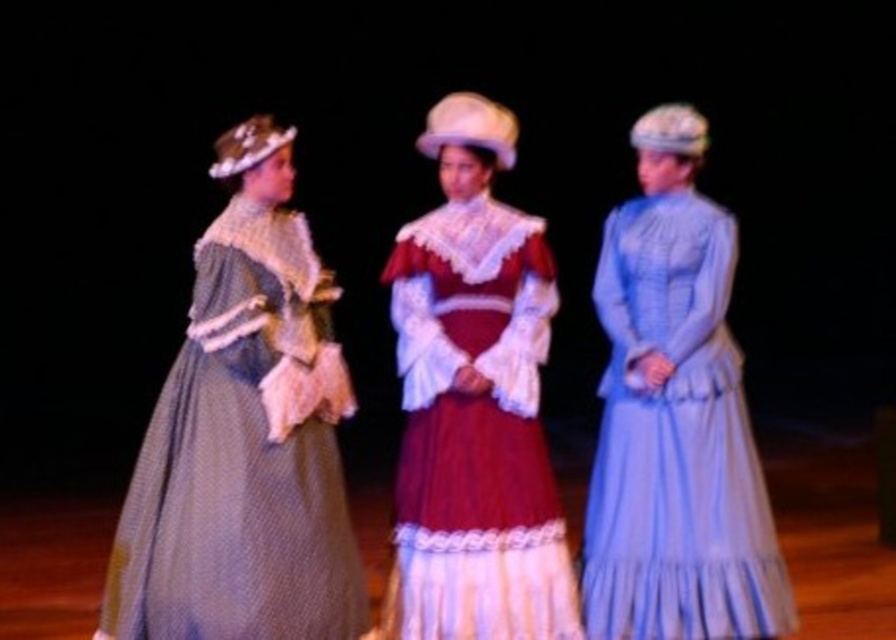
Question: Which point appears closest to the camera in this image?

Choices:
 (A) (480, 124)
 (B) (644, 625)
 (C) (338, 586)

Answer: (C)

Question: Does polka dot fabric dress at left have a greater width compared to velvet maroon dress at center?

Choices:
 (A) yes
 (B) no

Answer: (A)

Question: Which point is closer to the camera?

Choices:
 (A) light blue satin dress at center
 (B) polka dot fabric dress at left
 (C) velvet maroon dress at center

Answer: (B)

Question: Considering the relative positions of light blue satin dress at center and velvet maroon dress at center in the image provided, where is light blue satin dress at center located with respect to velvet maroon dress at center?

Choices:
 (A) above
 (B) below

Answer: (B)

Question: Among these objects, which one is nearest to the camera?

Choices:
 (A) polka dot fabric dress at left
 (B) light blue satin dress at center
 (C) velvet maroon dress at center

Answer: (A)

Question: Does polka dot fabric dress at left have a lesser width compared to velvet maroon dress at center?

Choices:
 (A) no
 (B) yes

Answer: (A)